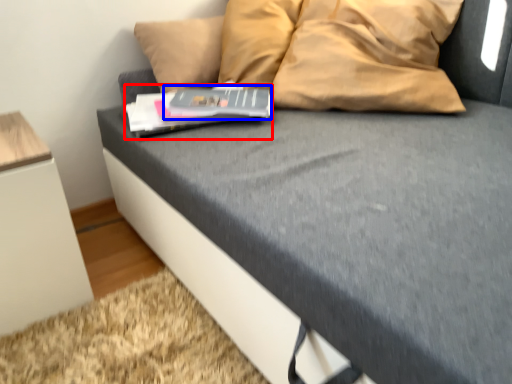
Question: Which of the following is the closest to the observer, paperback book (highlighted by a red box) or paperback book (highlighted by a blue box)?

Choices:
 (A) paperback book
 (B) paperback book

Answer: (A)